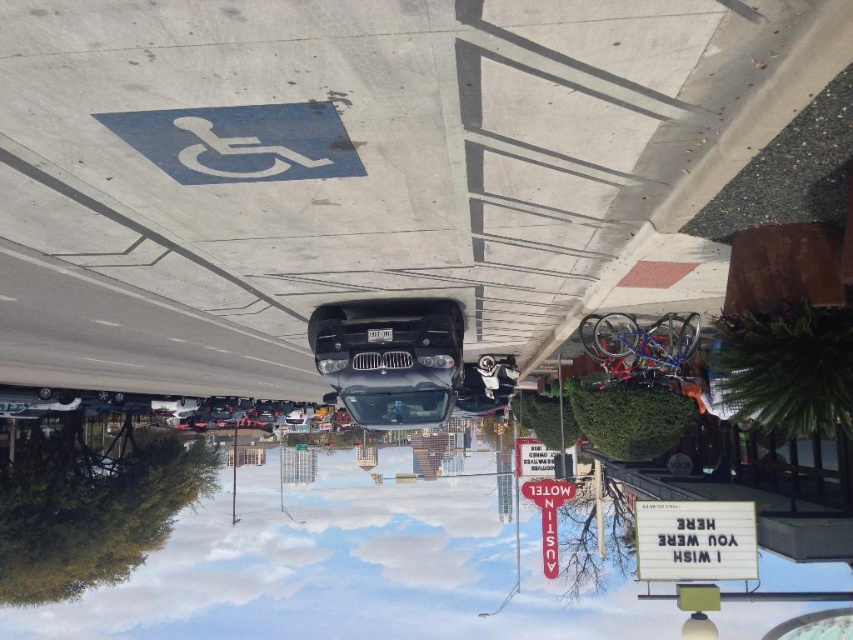
Who is more distant from viewer, (437, 328) or (668, 570)?

The point (437, 328) is behind.

Looking at this image, between sleek black car at center and white plastic sign at center, which one has more height?

With more height is sleek black car at center.

Who is more distant from viewer, (x=386, y=365) or (x=682, y=579)?

Point (x=386, y=365)

Locate an element on the screen. The image size is (853, 640). sleek black car at center is located at coordinates coord(387,344).